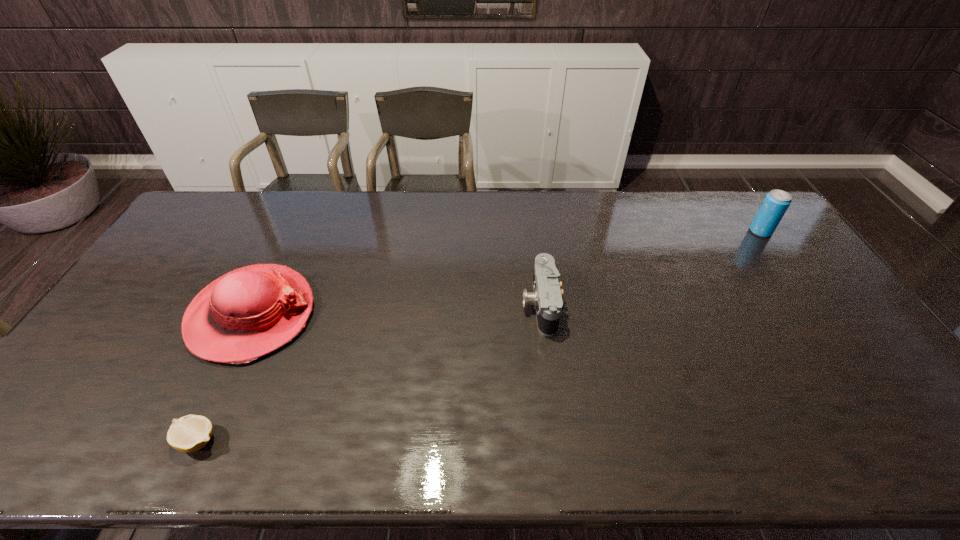
Locate an element on the screen. The height and width of the screenshot is (540, 960). vacant space that is in between the farthest object and the second object from right to left is located at coordinates (650, 268).

You are a GUI agent. You are given a task and a screenshot of the screen. Output one action in this format:
    pyautogui.click(x=<x>, y=<y>)
    Task: Click on the object that stands as the closest to the nearest object
    
    Given the screenshot: What is the action you would take?
    pyautogui.click(x=247, y=313)

Locate an element on the screen. object that ranks as the closest to the nearest object is located at coordinates [247, 313].

This screenshot has width=960, height=540. I want to click on vacant point that satisfies the following two spatial constraints: 1. on the lens of the third object from left to right; 2. on the front side of the shortest object, so click(x=558, y=441).

Where is `blank space that satisfies the following two spatial constraints: 1. at the front of the lemon with a bow; 2. on the right side of the hat`? blank space that satisfies the following two spatial constraints: 1. at the front of the lemon with a bow; 2. on the right side of the hat is located at coordinates (192, 441).

Locate an element on the screen. vacant point that satisfies the following two spatial constraints: 1. at the front of the hat with a bow; 2. on the left side of the nearest object is located at coordinates (192, 441).

Locate an element on the screen. This screenshot has width=960, height=540. free space in the image that satisfies the following two spatial constraints: 1. at the front of the nearest object with a bow; 2. on the right side of the hat is located at coordinates (192, 441).

Find the location of a particular element. blank space that satisfies the following two spatial constraints: 1. on the front side of the soda can; 2. on the lens of the second object from right to left is located at coordinates (812, 305).

This screenshot has height=540, width=960. I want to click on free space that satisfies the following two spatial constraints: 1. on the back side of the farthest object; 2. on the left side of the nearest object, so click(296, 232).